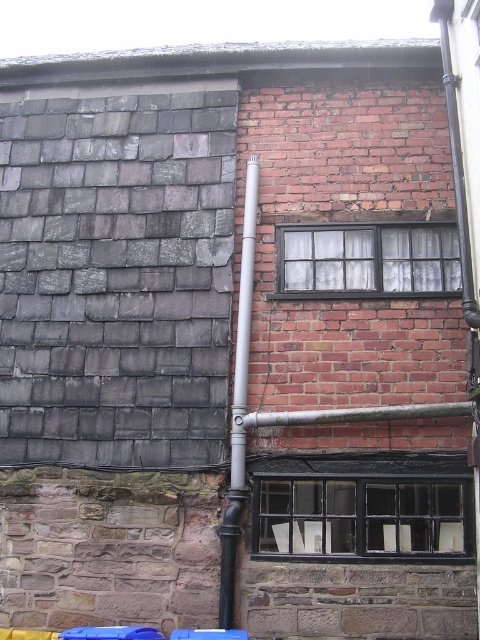
You are standing in front of the building and see two points marked on the wall. The first point is at coordinate point (419,534) and the second is at point (319,234). Which point is closer to you?

Point (419,534) is in front of point (319,234), so the first point is closer to you.

Based on the photo, you are standing in front of the building and notice the black painted wood window at lower center. Based on the coordinates provided, can you determine its position relative to the vertical pipe running down the center of the image?

The black painted wood window at lower center is located at point [361,516]. Since the vertical pipe is centered, the window is to the right and slightly below the pipe.

You are a window installer assessing the building exterior. You need to determine if the matte black window at center can be replaced with a new window that is 2 inches taller. The current silver metallic pipe at center is in the way. Based on their heights, is this replacement feasible?

The matte black window at center is shorter than the silver metallic pipe at center. Since the new window would be 2 inches taller, it might still be shorter than the pipe, so the replacement could be feasible if the increased height does not exceed the pipe length. However, precise measurements are needed to confirm.